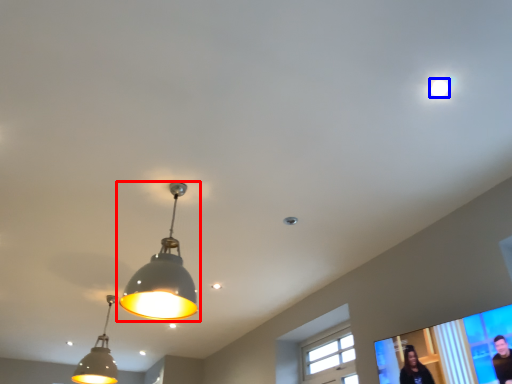
Question: Which object appears farthest to the camera in this image, lamp (highlighted by a red box) or droplight (highlighted by a blue box)?

Choices:
 (A) lamp
 (B) droplight

Answer: (A)